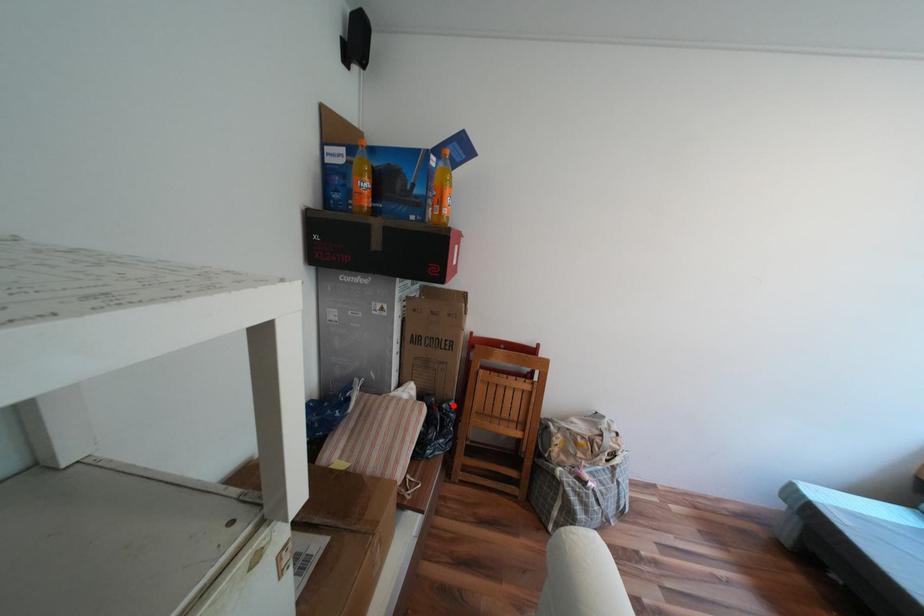
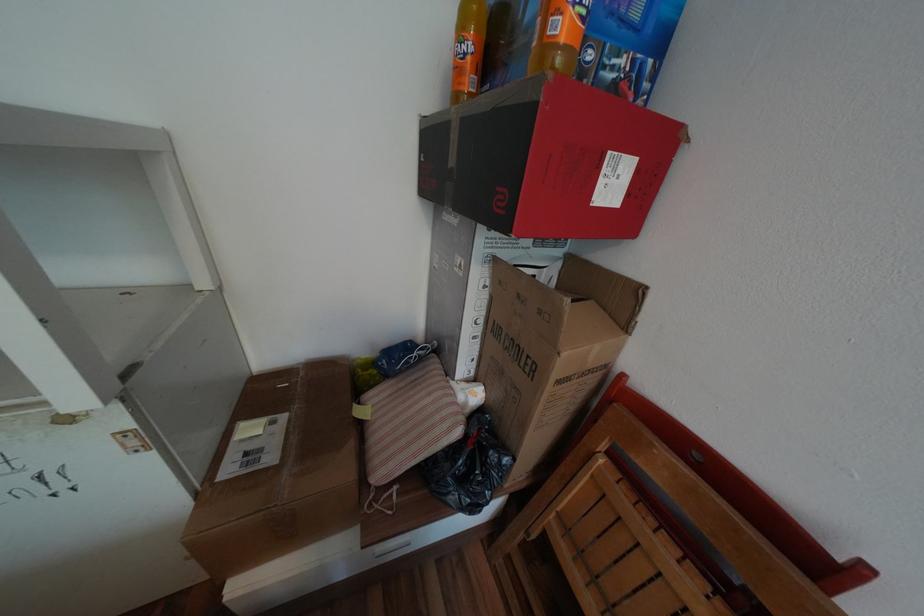
Question: I am providing you with two images of the same scene from different viewpoints. In image1, a red point is highlighted. Considering the same 3D point in image2, which of the following is correct?

Choices:
 (A) It is closer
 (B) It is farther

Answer: (A)